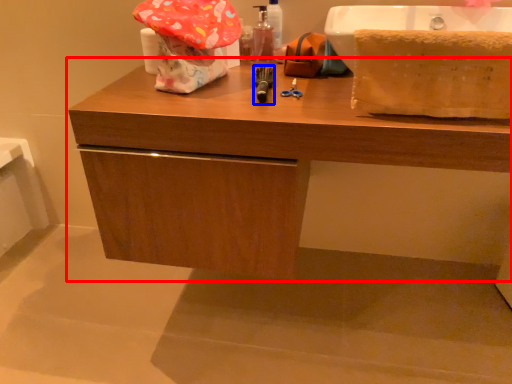
Question: Which object appears closest to the camera in this image, bathroom cabinet (highlighted by a red box) or tool (highlighted by a blue box)?

Choices:
 (A) bathroom cabinet
 (B) tool

Answer: (A)